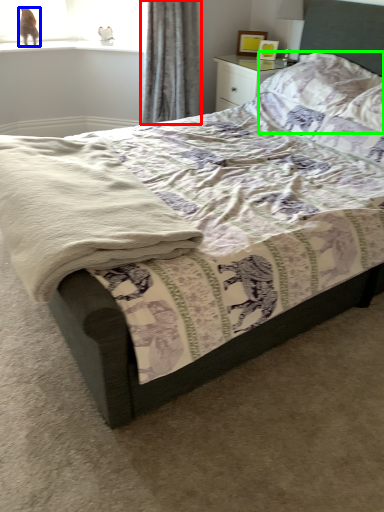
Question: Estimate the real-world distances between objects in this image. Which object is farther from curtain (highlighted by a red box), animal (highlighted by a blue box) or pillow (highlighted by a green box)?

Choices:
 (A) animal
 (B) pillow

Answer: (A)